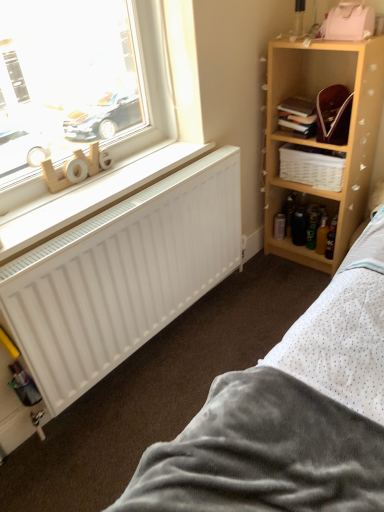
Locate an element on the screen. This screenshot has width=384, height=512. vacant space underneath white matte radiator at lower left (from a real-world perspective) is located at coordinates (184, 311).